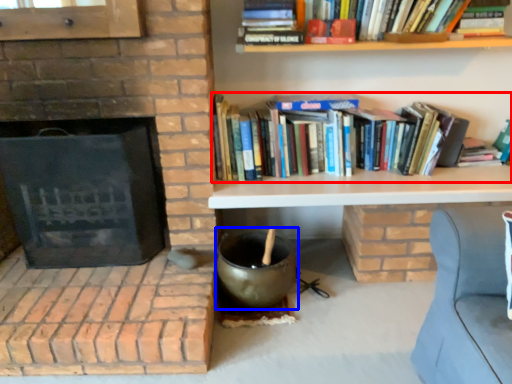
Question: Which object is further to the camera taking this photo, book (highlighted by a red box) or wok (highlighted by a blue box)?

Choices:
 (A) book
 (B) wok

Answer: (A)